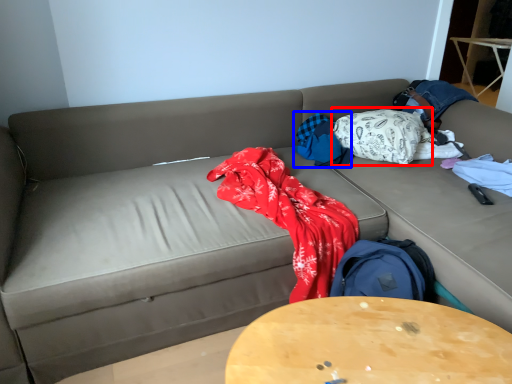
Question: Among these objects, which one is nearest to the camera, blanket (highlighted by a red box) or blanket (highlighted by a blue box)?

Choices:
 (A) blanket
 (B) blanket

Answer: (A)